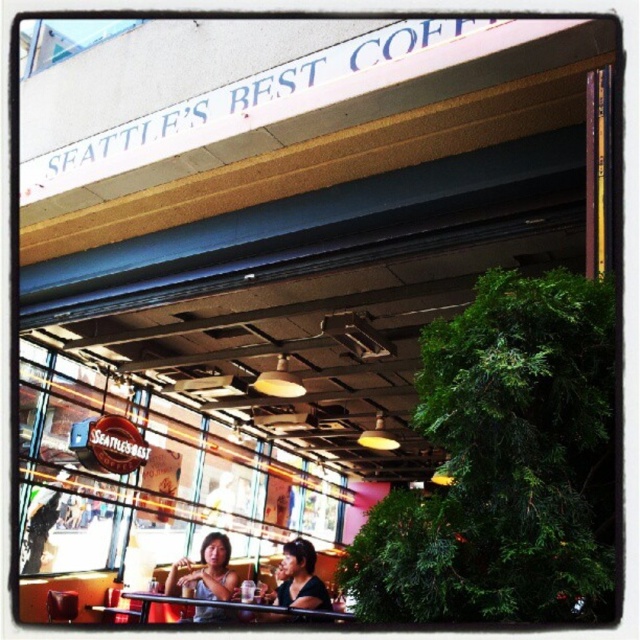
Question: Which of the following is the closest to the observer?

Choices:
 (A) matte white tank top at center
 (B) matte black shirt at lower center

Answer: (B)

Question: Is matte white tank top at center to the left of matte black shirt at lower center from the viewer's perspective?

Choices:
 (A) no
 (B) yes

Answer: (B)

Question: Can you confirm if matte white tank top at center is smaller than matte black shirt at lower center?

Choices:
 (A) no
 (B) yes

Answer: (B)

Question: Which point appears farthest from the camera in this image?

Choices:
 (A) (216, 563)
 (B) (301, 545)

Answer: (A)

Question: Can you confirm if matte white tank top at center is smaller than matte black shirt at lower center?

Choices:
 (A) yes
 (B) no

Answer: (A)